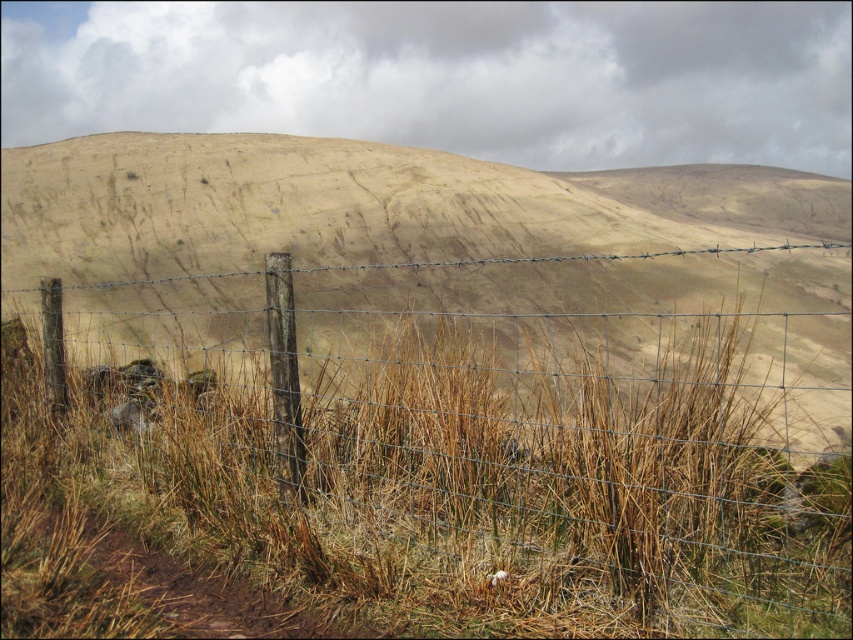
Who is positioned more to the left, wire mesh fence at center or dried grass at center?

Positioned to the left is dried grass at center.

Locate an element on the screen. wire mesh fence at center is located at coordinates (451, 460).